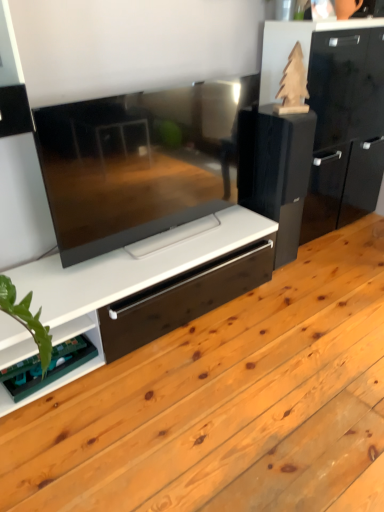
The width and height of the screenshot is (384, 512). I want to click on black glossy speaker at upper right, so click(275, 170).

Image resolution: width=384 pixels, height=512 pixels. What do you see at coordinates (275, 170) in the screenshot? I see `black glossy speaker at upper right` at bounding box center [275, 170].

Where is `green circuit board at lower left`? Image resolution: width=384 pixels, height=512 pixels. green circuit board at lower left is located at coordinates (59, 378).

This screenshot has height=512, width=384. Describe the element at coordinates (59, 378) in the screenshot. I see `green circuit board at lower left` at that location.

The height and width of the screenshot is (512, 384). What are the coordinates of `black glossy speaker at upper right` in the screenshot? It's located at (275, 170).

Can you confirm if black glossy speaker at upper right is positioned to the left of green circuit board at lower left?

No, black glossy speaker at upper right is not to the left of green circuit board at lower left.

Which object is further away from the camera, black glossy speaker at upper right or green circuit board at lower left?

black glossy speaker at upper right is more distant.

Which is more distant, (298, 193) or (62, 383)?

The point (298, 193) is behind.

From the image's perspective, is black glossy speaker at upper right located beneath green circuit board at lower left?

No.

From a real-world perspective, is black glossy speaker at upper right physically above green circuit board at lower left?

Yes, from a real-world perspective, black glossy speaker at upper right is over green circuit board at lower left

Does black glossy speaker at upper right have a lesser width compared to green circuit board at lower left?

In fact, black glossy speaker at upper right might be wider than green circuit board at lower left.

Does black glossy speaker at upper right have a greater height compared to green circuit board at lower left?

Correct, black glossy speaker at upper right is much taller as green circuit board at lower left.

Which of these two, black glossy speaker at upper right or green circuit board at lower left, is smaller?

With smaller size is green circuit board at lower left.

Do you think black glossy speaker at upper right is within green circuit board at lower left, or outside of it?

black glossy speaker at upper right is outside green circuit board at lower left.

Is black glossy speaker at upper right not near green circuit board at lower left?

Yes.

Is black glossy speaker at upper right facing towards green circuit board at lower left?

No, black glossy speaker at upper right is not turned towards green circuit board at lower left.

What's the angular difference between black glossy speaker at upper right and green circuit board at lower left's facing directions?

They differ by 5.87 degrees in their facing directions.

At what (x,y) coordinates should I click in order to perform the action: click on appliance that appears on the right of green circuit board at lower left. Please return your answer as a coordinate pair (x, y). The width and height of the screenshot is (384, 512). Looking at the image, I should click on (275, 170).

Considering the relative positions of green circuit board at lower left and black glossy speaker at upper right in the image provided, is green circuit board at lower left to the left of black glossy speaker at upper right from the viewer's perspective?

Indeed, green circuit board at lower left is positioned on the left side of black glossy speaker at upper right.

Which object is closer to the camera taking this photo, green circuit board at lower left or black glossy speaker at upper right?

green circuit board at lower left is closer to the camera.

Considering the positions of point (86, 370) and point (293, 205), is point (86, 370) closer or farther from the camera than point (293, 205)?

Clearly, point (86, 370) is closer to the camera than point (293, 205).

From the image's perspective, is green circuit board at lower left under black glossy speaker at upper right?

Indeed, from the image's perspective, green circuit board at lower left is shown beneath black glossy speaker at upper right.

From a real-world perspective, is green circuit board at lower left positioned under black glossy speaker at upper right based on gravity?

Correct, in the physical world, green circuit board at lower left is lower than black glossy speaker at upper right.

From the picture: Considering the sizes of green circuit board at lower left and black glossy speaker at upper right in the image, is green circuit board at lower left wider or thinner than black glossy speaker at upper right?

Clearly, green circuit board at lower left has less width compared to black glossy speaker at upper right.

Considering the relative sizes of green circuit board at lower left and black glossy speaker at upper right in the image provided, is green circuit board at lower left shorter than black glossy speaker at upper right?

Indeed, green circuit board at lower left has a lesser height compared to black glossy speaker at upper right.

Based on their sizes in the image, would you say green circuit board at lower left is bigger or smaller than black glossy speaker at upper right?

Clearly, green circuit board at lower left is smaller in size than black glossy speaker at upper right.

Consider the image. Is green circuit board at lower left spatially inside black glossy speaker at upper right, or outside of it?

green circuit board at lower left is located beyond the bounds of black glossy speaker at upper right.

Is green circuit board at lower left beside black glossy speaker at upper right?

No, green circuit board at lower left is not in contact with black glossy speaker at upper right.

Is green circuit board at lower left positioned with its back to black glossy speaker at upper right?

That's not correct — green circuit board at lower left is not looking away from black glossy speaker at upper right.

How different are the orientations of green circuit board at lower left and black glossy speaker at upper right in degrees?

There is a 5.87-degree angle between the facing directions of green circuit board at lower left and black glossy speaker at upper right.

Where is `appliance that is behind the green circuit board at lower left`? The image size is (384, 512). appliance that is behind the green circuit board at lower left is located at coordinates (275, 170).

Where is `appliance on the right side of green circuit board at lower left`? This screenshot has height=512, width=384. appliance on the right side of green circuit board at lower left is located at coordinates (275, 170).

Identify the location of appliance above the green circuit board at lower left (from a real-world perspective). (275, 170).